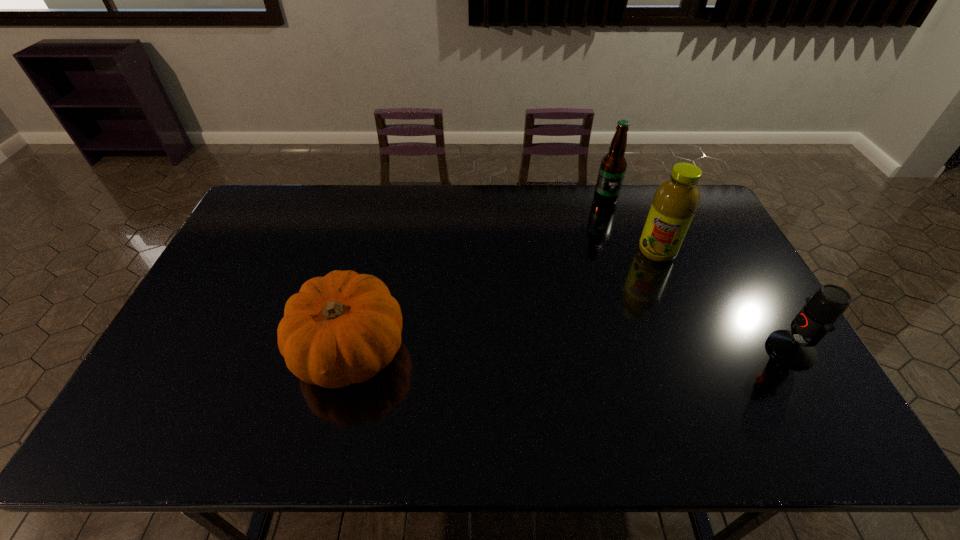
Where is `vacant space situated on the front label of the third nearest object`? The image size is (960, 540). vacant space situated on the front label of the third nearest object is located at coordinates (630, 306).

What are the coordinates of `vacant space located 0.090m on the front label of the third nearest object` in the screenshot? It's located at (642, 280).

The height and width of the screenshot is (540, 960). In order to click on vacant space located 0.300m on the front label of the third nearest object in this screenshot , I will do point(619,327).

This screenshot has height=540, width=960. I want to click on vacant space located on the label of the third object from right to left, so click(x=609, y=249).

At what (x,y) coordinates should I click in order to perform the action: click on vacant space positioned 0.250m on the label of the third object from right to left. Please return your answer as a coordinate pair (x, y). This screenshot has height=540, width=960. Looking at the image, I should click on (609, 253).

Find the location of a particular element. The image size is (960, 540). vacant space situated 0.390m on the label of the third object from right to left is located at coordinates click(611, 284).

The image size is (960, 540). What are the coordinates of `object present at the far edge` in the screenshot? It's located at (613, 165).

Image resolution: width=960 pixels, height=540 pixels. In order to click on object positioned at the near edge in this screenshot , I will do `click(343, 328)`.

You are a GUI agent. You are given a task and a screenshot of the screen. Output one action in this format:
    pyautogui.click(x=<x>, y=<y>)
    Task: Click on the object positioned at the right edge
    
    Given the screenshot: What is the action you would take?
    pyautogui.click(x=817, y=318)

The width and height of the screenshot is (960, 540). In the image, there is a desktop. Find the location of `vacant space at the far edge`. vacant space at the far edge is located at coordinates (482, 214).